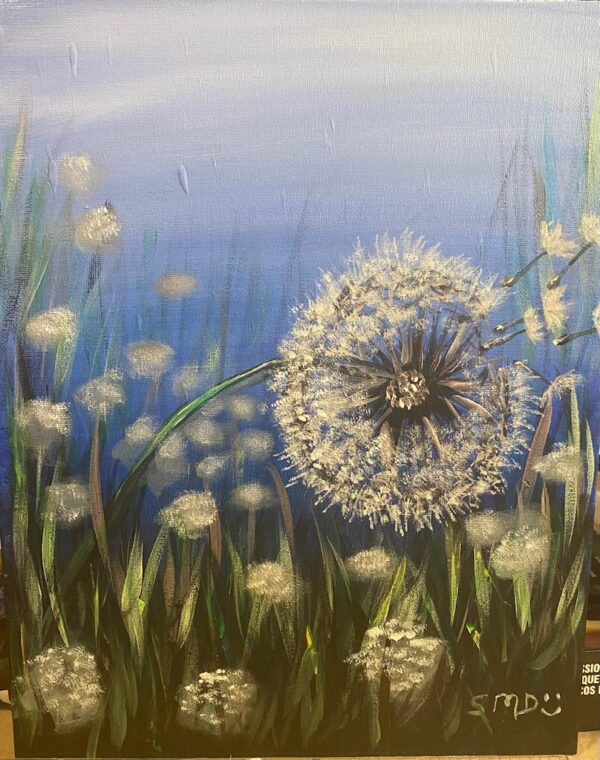
This screenshot has width=600, height=760. Identify the location of floor. (589, 746).